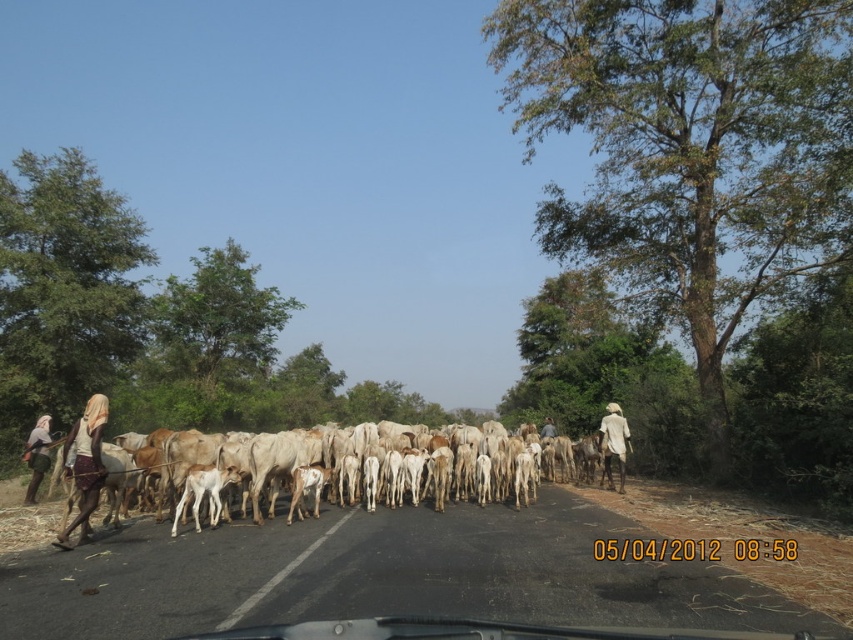
Who is positioned more to the left, white cloth at left or light brown fabric at left?

light brown fabric at left

Does white cloth at left have a greater width compared to light brown fabric at left?

Incorrect, white cloth at left's width does not surpass light brown fabric at left's.

Where is `white cloth at left`? The width and height of the screenshot is (853, 640). white cloth at left is located at coordinates (86, 465).

Between light brown fabric at left and brown fabric headscarf at center, which one is positioned higher?

light brown fabric at left

What do you see at coordinates (38, 456) in the screenshot?
I see `light brown fabric at left` at bounding box center [38, 456].

Does point (47, 438) come in front of point (550, 426)?

Yes, it is in front of point (550, 426).

At what (x,y) coordinates should I click in order to perform the action: click on light brown fabric at left. Please return your answer as a coordinate pair (x, y). The height and width of the screenshot is (640, 853). Looking at the image, I should click on (38, 456).

Is point (67, 504) closer to camera compared to point (30, 438)?

Yes, it is.

What do you see at coordinates (84, 474) in the screenshot?
I see `white woolly cows at center` at bounding box center [84, 474].

Identify the location of white woolly cows at center. This screenshot has width=853, height=640. (84, 474).